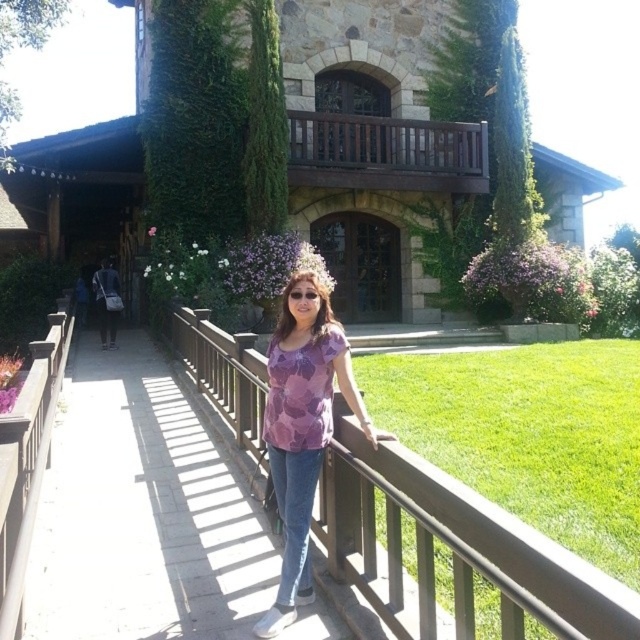
You are a photographer standing at the point marked as point (141, 513). You want to take a photo of the wooden bridge at center. Where should you position yourself relative to the wooden bridge at center?

The wooden bridge at center is located at point (141, 513), so you should position yourself at the same point to capture the wooden bridge at center in your photo.

You are a photographer trying to capture the wooden at center and the brown wooden balustrade at upper center in the same frame. Based on their positions, which object should appear closer to the camera in the photo?

The wooden at center is in front of the brown wooden balustrade at upper center, so it will appear closer to the camera in the photo.